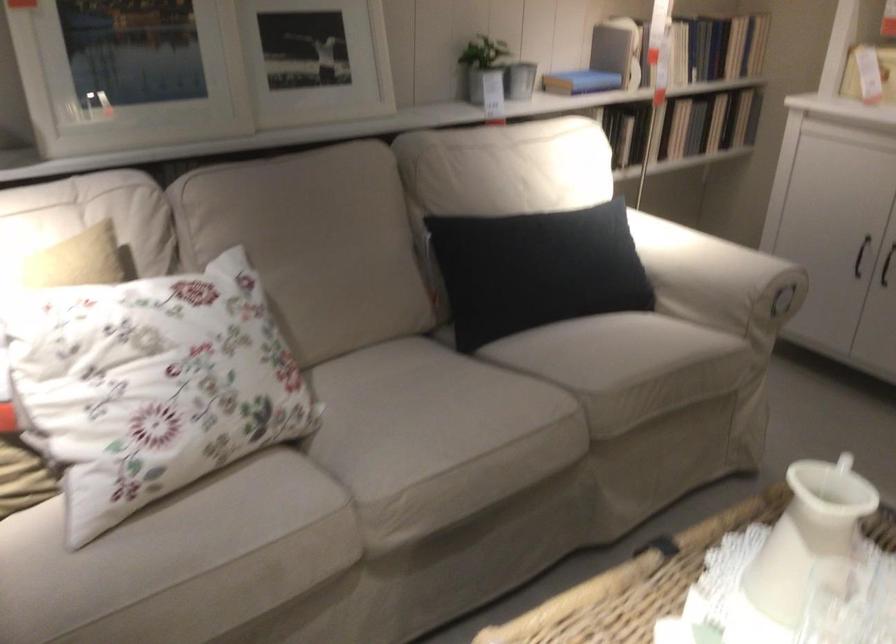
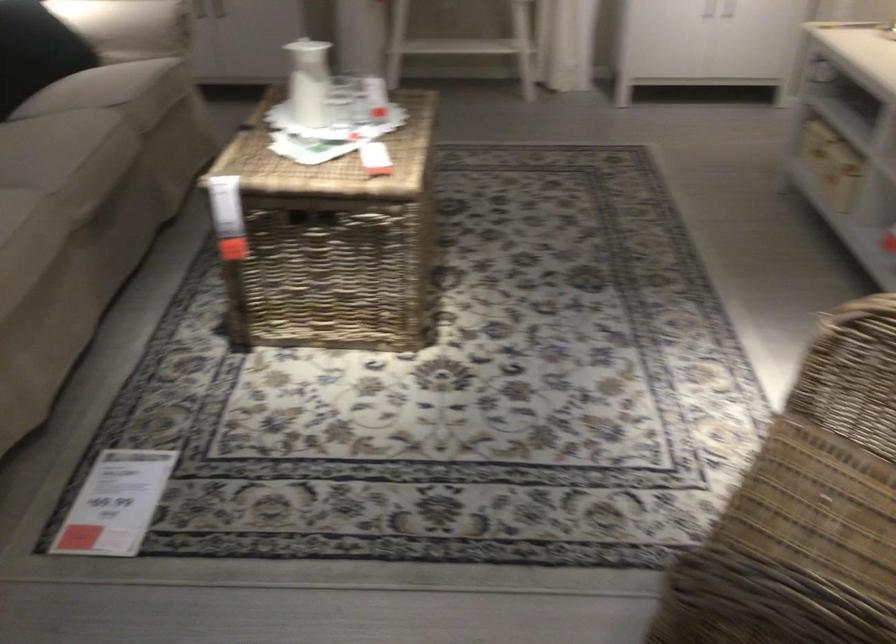
The point at (x=512, y=444) is marked in the first image. Where is the corresponding point in the second image?

(109, 140)